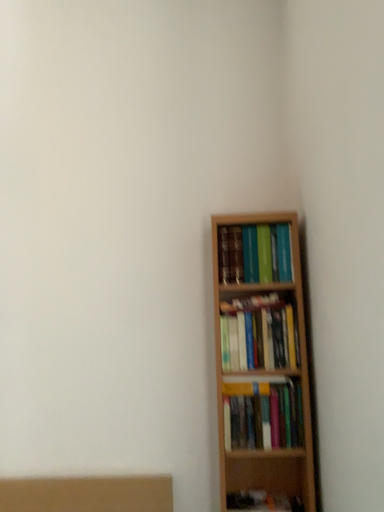
Question: Is hardcover books at upper right, marked as the 1th book in a top-to-bottom arrangement, wider or thinner than wooden bookshelf at right, placed as the 2th book when sorted from bottom to top?

Choices:
 (A) thin
 (B) wide

Answer: (B)

Question: Based on their positions, is hardcover books at upper right, the third book ordered from the bottom, located to the left or right of wooden bookshelf at right, placed as the 2th book when sorted from bottom to top?

Choices:
 (A) right
 (B) left

Answer: (B)

Question: Estimate the real-world distances between objects in this image. Which object is farther from the hardcover books at upper right, the third book ordered from the bottom?

Choices:
 (A) wooden bookshelf at right, the second book viewed from the top
 (B) wooden bookshelf at right, marked as the third book in a top-to-bottom arrangement

Answer: (B)

Question: Which of these objects is positioned farthest from the wooden bookshelf at right, placed as the 2th book when sorted from bottom to top?

Choices:
 (A) wooden bookshelf at right, placed as the 1th book when sorted from bottom to top
 (B) hardcover books at upper right, marked as the 1th book in a top-to-bottom arrangement

Answer: (B)